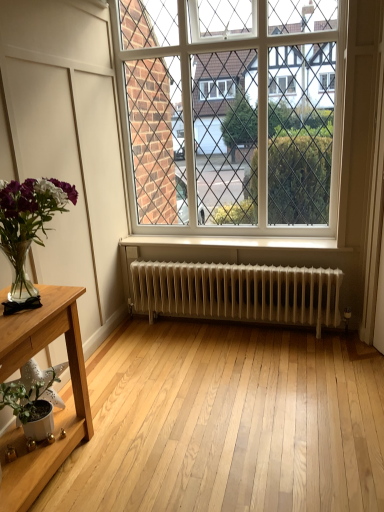
Question: Would you say white glass window at center is a long distance from translucent glass vase at left, the second houseplant when ordered from bottom to top?

Choices:
 (A) yes
 (B) no

Answer: (A)

Question: Is white glass window at center bigger than translucent glass vase at left, the first houseplant positioned from the top?

Choices:
 (A) no
 (B) yes

Answer: (B)

Question: From a real-world perspective, is white glass window at center on top of translucent glass vase at left, the first houseplant positioned from the top?

Choices:
 (A) yes
 (B) no

Answer: (A)

Question: Does white glass window at center have a lesser width compared to translucent glass vase at left, the second houseplant when ordered from bottom to top?

Choices:
 (A) yes
 (B) no

Answer: (A)

Question: Does white glass window at center have a greater width compared to translucent glass vase at left, the second houseplant when ordered from bottom to top?

Choices:
 (A) yes
 (B) no

Answer: (B)

Question: From the image's perspective, is white glass window at center positioned above or below translucent glass vase at left, the first houseplant positioned from the top?

Choices:
 (A) below
 (B) above

Answer: (B)

Question: Considering their positions, is white glass window at center located in front of or behind translucent glass vase at left, the second houseplant when ordered from bottom to top?

Choices:
 (A) front
 (B) behind

Answer: (B)

Question: Considering the positions of point (317, 4) and point (4, 237), is point (317, 4) closer or farther from the camera than point (4, 237)?

Choices:
 (A) closer
 (B) farther

Answer: (B)

Question: Looking at their shapes, would you say white glass window at center is wider or thinner than translucent glass vase at left, the second houseplant when ordered from bottom to top?

Choices:
 (A) thin
 (B) wide

Answer: (A)

Question: Considering the positions of white glass window at center and white matte pot at lower left, the first houseplant when ordered from bottom to top, in the image, is white glass window at center taller or shorter than white matte pot at lower left, the first houseplant when ordered from bottom to top,?

Choices:
 (A) short
 (B) tall

Answer: (B)

Question: From a real-world perspective, is white glass window at center positioned above or below white matte pot at lower left, acting as the second houseplant starting from the top?

Choices:
 (A) below
 (B) above

Answer: (B)

Question: From the image's perspective, is white glass window at center located above or below white matte pot at lower left, acting as the second houseplant starting from the top?

Choices:
 (A) above
 (B) below

Answer: (A)

Question: In terms of size, does white glass window at center appear bigger or smaller than white matte pot at lower left, the first houseplant when ordered from bottom to top?

Choices:
 (A) small
 (B) big

Answer: (B)

Question: Visually, is light wood table at lower left positioned to the left or to the right of white glass window at center?

Choices:
 (A) left
 (B) right

Answer: (A)

Question: Relative to white glass window at center, is light wood table at lower left in front or behind?

Choices:
 (A) behind
 (B) front

Answer: (B)